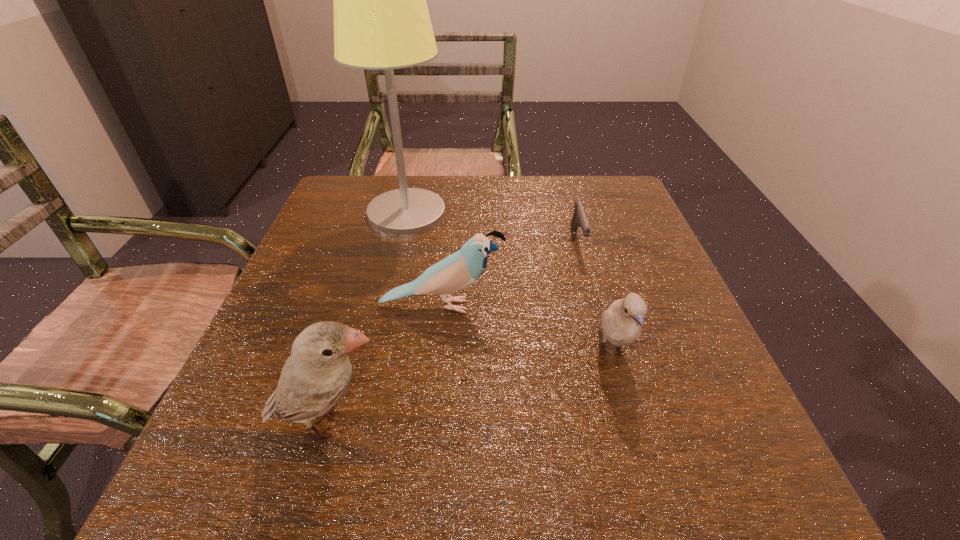
Find the location of a particular element. Image resolution: width=960 pixels, height=540 pixels. vacant region that satisfies the following two spatial constraints: 1. at the beak of the second farthest bird; 2. at the face of the tallest bird is located at coordinates (632, 424).

Where is `vacant region that satisfies the following two spatial constraints: 1. at the barrel of the pistol; 2. at the face of the third farthest object`? This screenshot has width=960, height=540. vacant region that satisfies the following two spatial constraints: 1. at the barrel of the pistol; 2. at the face of the third farthest object is located at coordinates (594, 306).

Identify the location of free space that satisfies the following two spatial constraints: 1. at the barrel of the pistol; 2. at the face of the farthest bird. This screenshot has width=960, height=540. pos(594,306).

You are a GUI agent. You are given a task and a screenshot of the screen. Output one action in this format:
    pyautogui.click(x=<x>, y=<y>)
    Task: Click on the free space that satisfies the following two spatial constraints: 1. at the barrel of the shortest object; 2. at the face of the third farthest object
    The width and height of the screenshot is (960, 540).
    Given the screenshot: What is the action you would take?
    click(x=594, y=306)

This screenshot has height=540, width=960. Identify the location of vacant space that satisfies the following two spatial constraints: 1. at the barrel of the pistol; 2. at the face of the third nearest object. (594, 306).